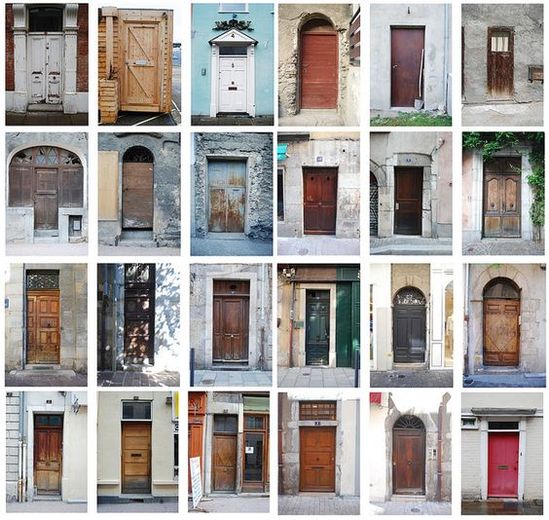
At what (x,y) coordinates should I click in order to perform the action: click on mail slots. Please return your answer as a coordinate pair (x, y). The image size is (549, 520). Looking at the image, I should click on (231, 87), (142, 63), (237, 189), (47, 191), (136, 455), (317, 466), (503, 466).